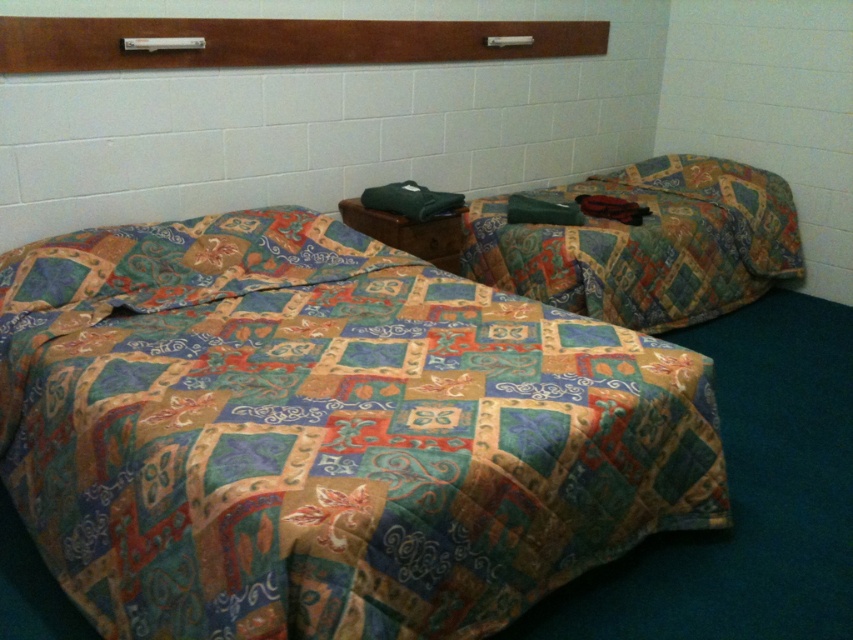
You are a guest in a hotel room and want to make sure you don not accidentally use your roommate s belongings. The patchwork quilt at center and the patterned fabric bed at right are both in your room. Which one is closer to you if you are standing at the entrance?

The patchwork quilt at center is closer to you because it is in front of the patterned fabric bed at right.

You are a hotel guest who just arrived and wants to unpack your luggage. You have a pair of socks that you want to place on the nearest bed. The patchwork quilt at center and the patterned fabric bed at right are both available. Which bed should you choose?

The patchwork quilt at center is to the left of patterned fabric bed at right, so the patchwork quilt at center is closer to you. You should place the socks on the patchwork quilt at center.